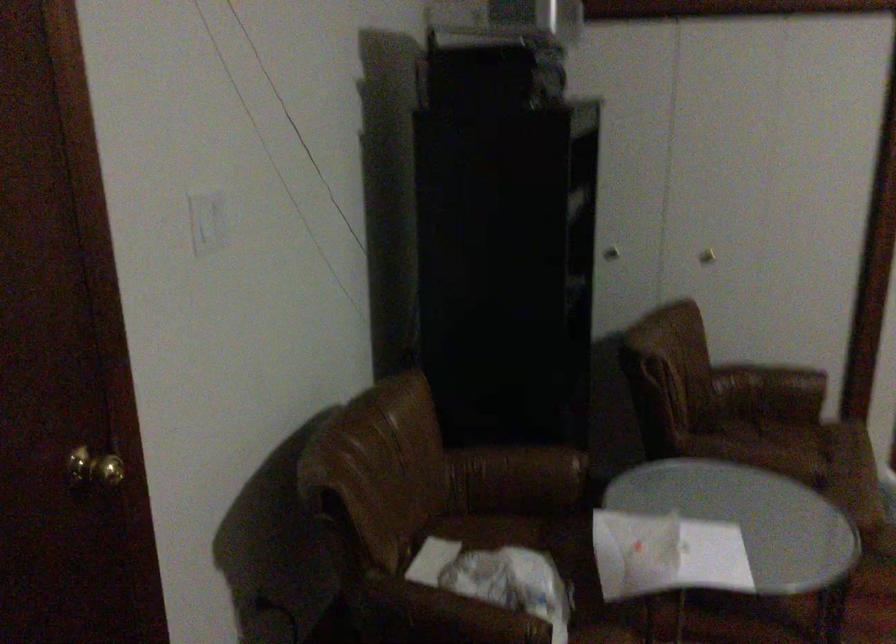
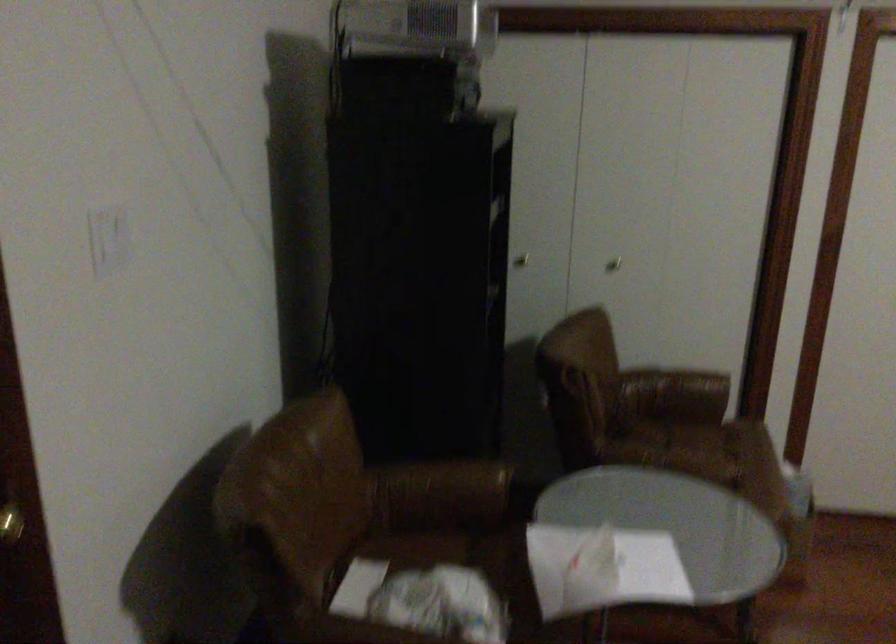
Find the pixel in the second image that matches (x=705, y=258) in the first image.

(613, 263)